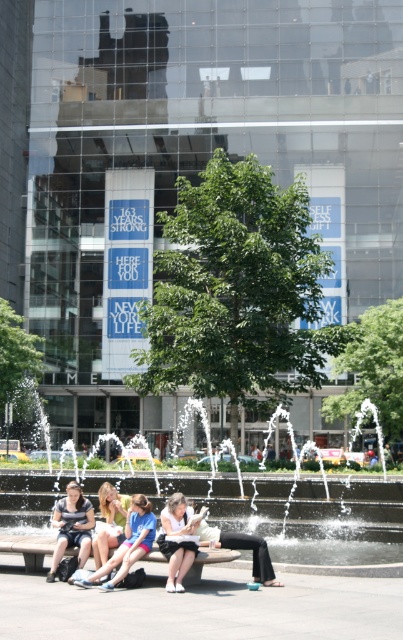
You are standing at the center of the public fountain area and want to find the denim shorts at lower left. Which direction should you walk to reach them?

The denim shorts at lower left are located at point (128, 544), so you should walk towards the lower left direction to reach them.

You are standing at the point marked as point (241, 548) in the image. What color are the pants you are standing on?

The pants at the point marked as point (241, 548) are light beige.

You are a photographer trying to capture a candid shot of the blonde hair at center without including the denim shorts at lower left in the frame. Based on their positions, is this possible?

The denim shorts at lower left are to the right of the blonde hair at center, so positioning the camera to focus solely on the blonde hair at center without including the denim shorts at lower left would be possible by angling the shot to exclude the area where the denim shorts at lower left are located.